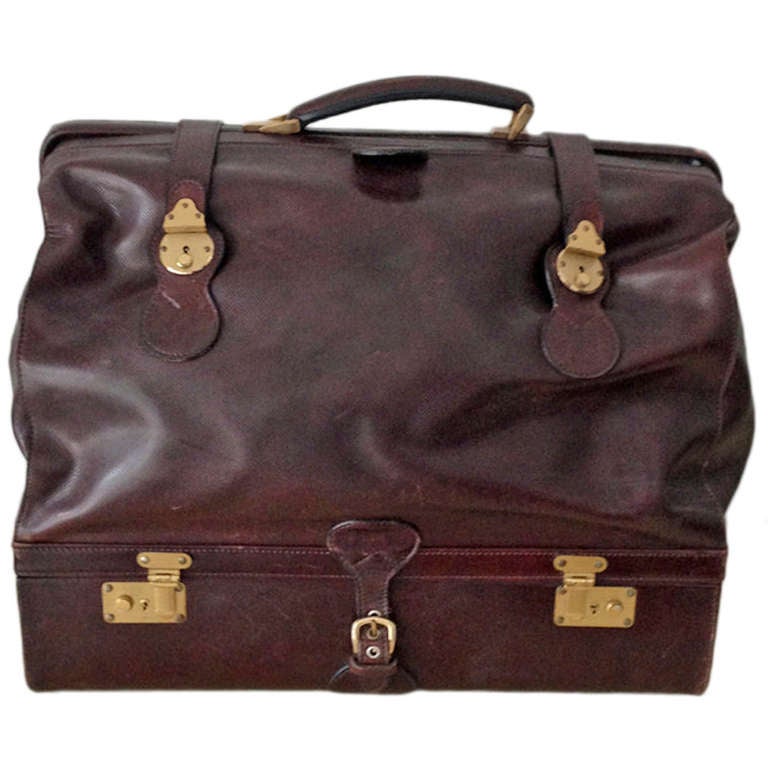
Image resolution: width=768 pixels, height=768 pixels. Find the location of `handle`. handle is located at coordinates click(445, 90).